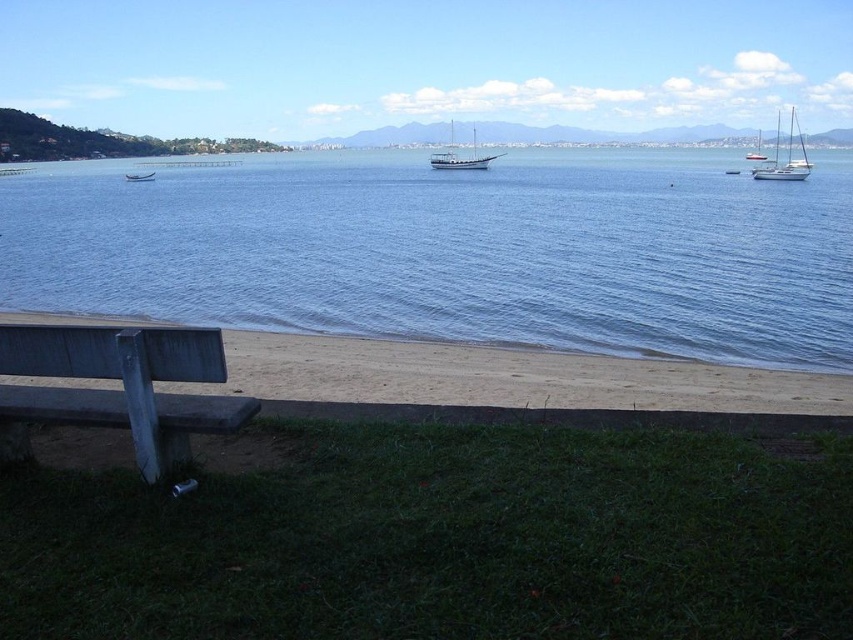
Question: Is light brown sand at lower center smaller than wooden canoe at center?

Choices:
 (A) no
 (B) yes

Answer: (A)

Question: Does light brown sand at lower center appear on the right side of wooden sailboat at center?

Choices:
 (A) yes
 (B) no

Answer: (B)

Question: Which point is farther to the camera?

Choices:
 (A) wooden canoe at center
 (B) blue water at center

Answer: (A)

Question: Where is gray wooden bench at lower left located in relation to white glossy sailboat at right in the image?

Choices:
 (A) right
 (B) left

Answer: (B)

Question: Which object appears closest to the camera in this image?

Choices:
 (A) light brown sand at lower center
 (B) wooden sailboat at center
 (C) white glossy sailboat at right

Answer: (A)

Question: Which point is closer to the camera taking this photo?

Choices:
 (A) (798, 138)
 (B) (158, 262)
 (C) (753, 156)

Answer: (B)